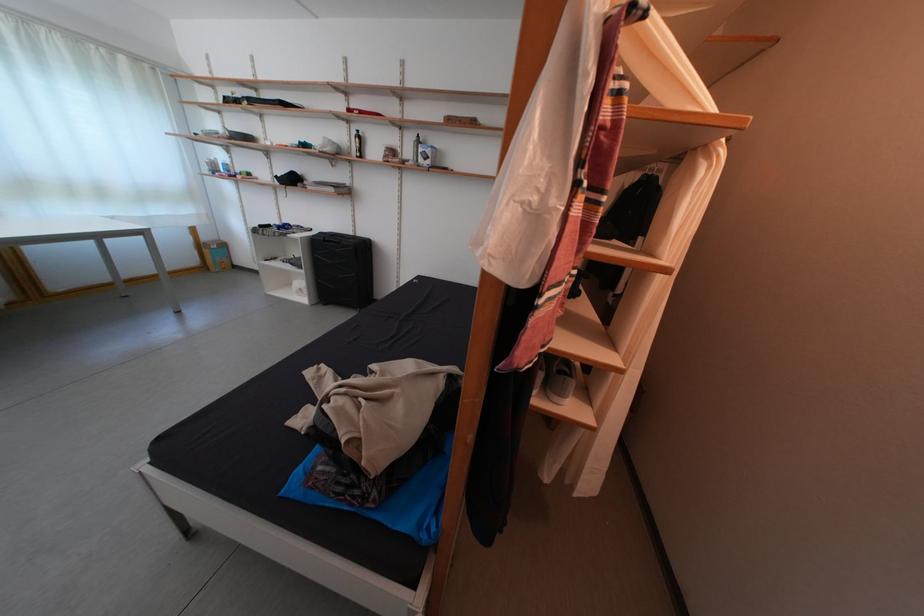
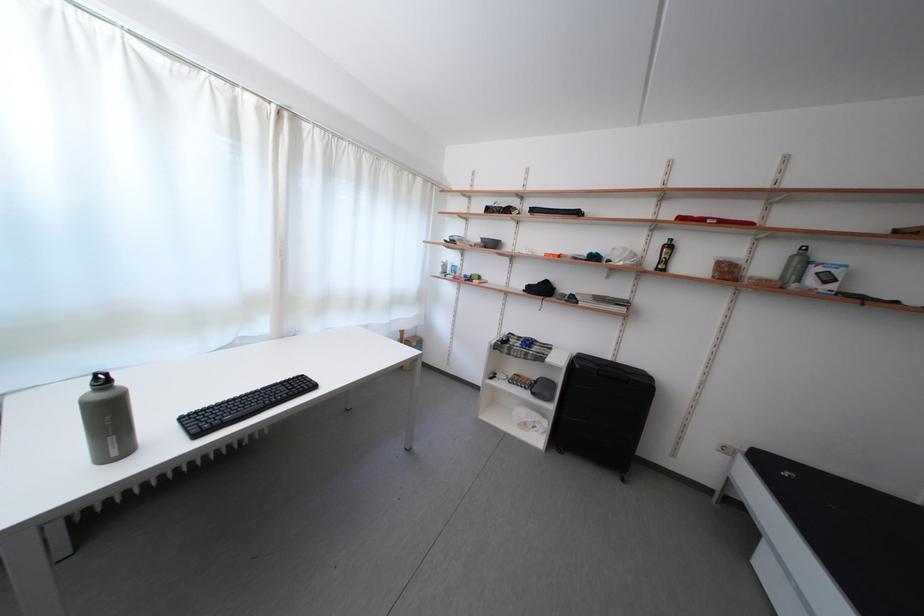
The point at (362, 138) is marked in the first image. Where is the corresponding point in the second image?

(669, 246)